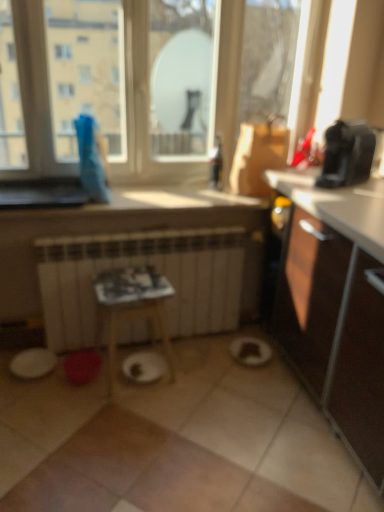
Image resolution: width=384 pixels, height=512 pixels. What do you see at coordinates (164, 80) in the screenshot? I see `transparent glass window at upper center` at bounding box center [164, 80].

In order to face transparent glass window at upper center, should I rotate leftwards or rightwards?

A 3.593 degree turn to the left will do.

What are the coordinates of `white matte paper plate at center` in the screenshot? It's located at (144, 367).

What do you see at coordinates (144, 367) in the screenshot? This screenshot has height=512, width=384. I see `white matte paper plate at center` at bounding box center [144, 367].

You are a GUI agent. You are given a task and a screenshot of the screen. Output one action in this format:
    pyautogui.click(x=<x>, y=<y>)
    Task: Click on the wooden table at center
    
    Given the screenshot: What is the action you would take?
    pyautogui.click(x=131, y=307)

The image size is (384, 512). What do you see at coordinates (142, 264) in the screenshot?
I see `white matte radiator at center` at bounding box center [142, 264].

Image resolution: width=384 pixels, height=512 pixels. What are the coordinates of `white matte radiator at center` in the screenshot? It's located at (142, 264).

Find the location of `black plastic coffee maker at upper right`. black plastic coffee maker at upper right is located at coordinates (347, 154).

Find the location of a particular element. This screenshot has width=384, height=512. transparent glass window at upper center is located at coordinates (164, 80).

Is wooden table at center oriented away from black plastic coffee maker at upper right?

wooden table at center does not have its back to black plastic coffee maker at upper right.

Would you consider wooden table at center to be distant from black plastic coffee maker at upper right?

They are positioned close to each other.

Considering the positions of objects wooden table at center and black plastic coffee maker at upper right in the image provided, who is more to the left, wooden table at center or black plastic coffee maker at upper right?

Positioned to the left is wooden table at center.

Is point (101, 298) positioned after point (353, 181)?

No.

Which is less distant, (23, 37) or (77, 328)?

Point (23, 37) is positioned closer to the camera compared to point (77, 328).

Consider the image. In the image, is transparent glass window at upper center positioned in front of or behind white matte radiator at center?

In the image, transparent glass window at upper center appears in front of white matte radiator at center.

Considering the sizes of objects transparent glass window at upper center and white matte radiator at center in the image provided, who is shorter, transparent glass window at upper center or white matte radiator at center?

With less height is white matte radiator at center.

Locate an element on the screen. The width and height of the screenshot is (384, 512). radiator lying on the left of transparent glass window at upper center is located at coordinates (142, 264).

Is the position of white matte radiator at center less distant than that of black plastic coffee maker at upper right?

No, it is behind black plastic coffee maker at upper right.

In the scene shown: Considering the sizes of white matte radiator at center and black plastic coffee maker at upper right in the image, is white matte radiator at center wider or thinner than black plastic coffee maker at upper right?

Considering their sizes, white matte radiator at center looks slimmer than black plastic coffee maker at upper right.

Is the surface of white matte radiator at center in direct contact with black plastic coffee maker at upper right?

white matte radiator at center is not next to black plastic coffee maker at upper right, and they're not touching.

Between wooden table at center and white matte radiator at center, which one has smaller size?

wooden table at center.

From the image's perspective, which object appears higher, wooden table at center or white matte radiator at center?

white matte radiator at center, from the image's perspective.

Can you confirm if wooden table at center is positioned to the left of white matte radiator at center?

Indeed, wooden table at center is positioned on the left side of white matte radiator at center.

Considering the relative positions of transparent glass window at upper center and white matte paper plate at center in the image provided, is transparent glass window at upper center to the right of white matte paper plate at center from the viewer's perspective?

Yes, transparent glass window at upper center is to the right of white matte paper plate at center.

Considering the sizes of objects transparent glass window at upper center and white matte paper plate at center in the image provided, who is wider, transparent glass window at upper center or white matte paper plate at center?

Wider between the two is white matte paper plate at center.

Is transparent glass window at upper center turned away from white matte paper plate at center?

No, transparent glass window at upper center's orientation is not away from white matte paper plate at center.

Considering the positions of point (348, 184) and point (59, 62), is point (348, 184) closer or farther from the camera than point (59, 62)?

Point (348, 184).

Identify the location of window that is on the left side of black plastic coffee maker at upper right. The height and width of the screenshot is (512, 384). (164, 80).

Is black plastic coffee maker at upper right taller than transparent glass window at upper center?

In fact, black plastic coffee maker at upper right may be shorter than transparent glass window at upper center.

Is black plastic coffee maker at upper right aimed at transparent glass window at upper center?

No, black plastic coffee maker at upper right is not facing towards transparent glass window at upper center.

Which of these two, black plastic coffee maker at upper right or white matte radiator at center, is smaller?

black plastic coffee maker at upper right.

From a real-world perspective, is black plastic coffee maker at upper right above or below white matte radiator at center?

From a real-world perspective, black plastic coffee maker at upper right is physically above white matte radiator at center.

How many degrees apart are the facing directions of black plastic coffee maker at upper right and white matte radiator at center?

65.9 degrees.

Could you tell me if black plastic coffee maker at upper right is facing white matte radiator at center?

No, black plastic coffee maker at upper right is not oriented towards white matte radiator at center.

The width and height of the screenshot is (384, 512). What are the coordinates of `table located behind the black plastic coffee maker at upper right` in the screenshot? It's located at (131, 307).

At what (x,y) coordinates should I click in order to perform the action: click on window located on the right of white matte radiator at center. Please return your answer as a coordinate pair (x, y). Looking at the image, I should click on (164, 80).

Looking at the image, which one is located further to transparent glass window at upper center, black plastic coffee maker at upper right or wooden table at center?

The object further to transparent glass window at upper center is wooden table at center.

Considering their positions, is white matte radiator at center positioned closer to wooden table at center than white matte paper plate at center?

white matte radiator at center.

Based on their spatial positions, is white matte paper plate at center or white matte radiator at center further from black plastic coffee maker at upper right?

white matte paper plate at center is positioned further to the anchor black plastic coffee maker at upper right.

Considering their positions, is white matte radiator at center positioned closer to black plastic coffee maker at upper right than white matte paper plate at center?

Among the two, white matte radiator at center is located nearer to black plastic coffee maker at upper right.

From the picture: Based on their spatial positions, is wooden table at center or white matte paper plate at center closer to transparent glass window at upper center?

The object closer to transparent glass window at upper center is wooden table at center.

Which object lies further to the anchor point white matte radiator at center, black plastic coffee maker at upper right or wooden table at center?

black plastic coffee maker at upper right is further to white matte radiator at center.

When comparing their distances from white matte radiator at center, does transparent glass window at upper center or wooden table at center seem further?

transparent glass window at upper center is further to white matte radiator at center.

Looking at the image, which one is located further to black plastic coffee maker at upper right, transparent glass window at upper center or white matte paper plate at center?

white matte paper plate at center is further to black plastic coffee maker at upper right.

In order to click on radiator that lies between transparent glass window at upper center and white matte paper plate at center from top to bottom in this screenshot , I will do `click(142, 264)`.

This screenshot has height=512, width=384. I want to click on paper plate between wooden table at center and black plastic coffee maker at upper right from left to right, so click(x=144, y=367).

You are a GUI agent. You are given a task and a screenshot of the screen. Output one action in this format:
    pyautogui.click(x=<x>, y=<y>)
    Task: Click on the radiator between wooden table at center and black plastic coffee maker at upper right from left to right
    
    Given the screenshot: What is the action you would take?
    pyautogui.click(x=142, y=264)

Image resolution: width=384 pixels, height=512 pixels. Identify the location of radiator between white matte paper plate at center and black plastic coffee maker at upper right. (142, 264).